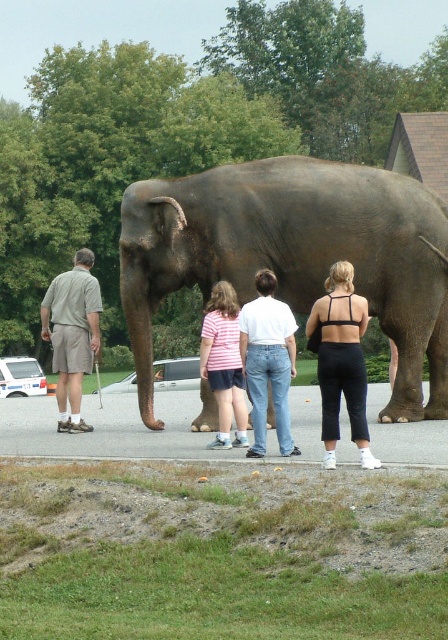
This screenshot has width=448, height=640. I want to click on gray textured elephant at center, so (x=294, y=256).

Can you confirm if gray textured elephant at center is positioned below black matte pants at center?

No.

Find the location of a particular element. This screenshot has width=448, height=640. gray textured elephant at center is located at coordinates (294, 256).

From the picture: Is gray textured elephant at center to the left of striped cotton shirt at center from the viewer's perspective?

Correct, you'll find gray textured elephant at center to the left of striped cotton shirt at center.

Can you confirm if gray textured elephant at center is positioned to the right of striped cotton shirt at center?

In fact, gray textured elephant at center is to the left of striped cotton shirt at center.

Does point (430, 410) come behind point (216, 349)?

Yes, it is behind point (216, 349).

What are the coordinates of `gray textured elephant at center` in the screenshot? It's located at (294, 256).

Between gray textured elephant at center and light brown shorts at left, which one has less height?

Standing shorter between the two is light brown shorts at left.

Between gray textured elephant at center and light brown shorts at left, which one appears on the right side from the viewer's perspective?

light brown shorts at left is more to the right.

Who is more distant from viewer, (254, 182) or (70, 298)?

The point (254, 182) is more distant.

Find the location of a particular element. The image size is (448, 640). gray textured elephant at center is located at coordinates (294, 256).